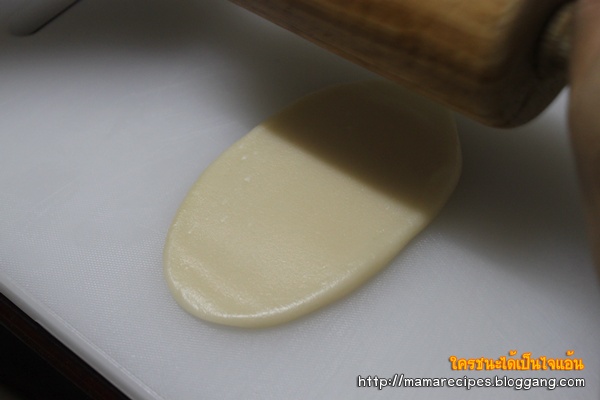
You are a GUI agent. You are given a task and a screenshot of the screen. Output one action in this format:
    pyautogui.click(x=<x>, y=<y>)
    Task: Click on the counter top
    
    Given the screenshot: What is the action you would take?
    pyautogui.click(x=31, y=228)